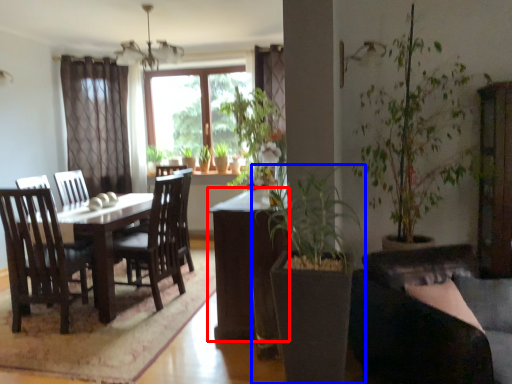
Question: Which point is closer to the camera, table (highlighted by a red box) or houseplant (highlighted by a blue box)?

Choices:
 (A) table
 (B) houseplant

Answer: (B)